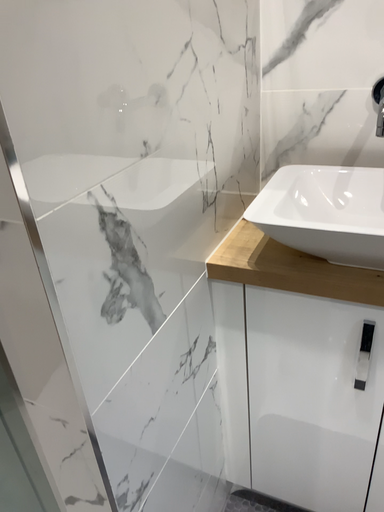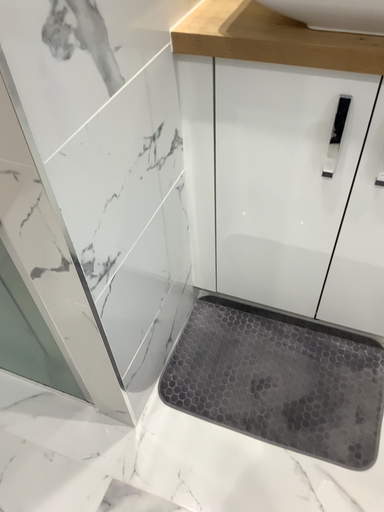
Question: How did the camera likely rotate when shooting the video?

Choices:
 (A) rotated downward
 (B) rotated upward

Answer: (A)